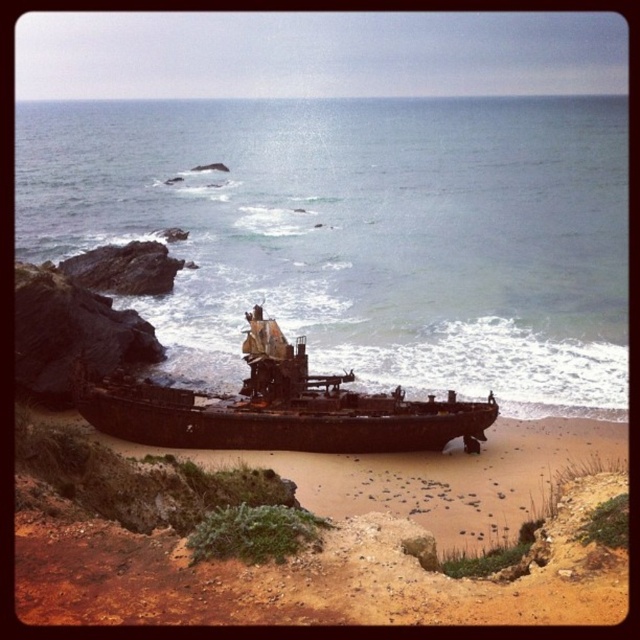
Consider the image. You are a marine biologist studying shipwrecks. You notice the clear blue water at lower center and the rusty metal pirate ship at center. Which object is above the other?

The clear blue water at lower center is positioned over the rusty metal pirate ship at center, so the water is above the ship.

You are standing on the beach and want to take a photo of the clear blue water at lower center and the rusty metal pirate ship at center. Which object should you focus on first if you want both to be in sharp focus?

You should focus on the rusty metal pirate ship at center first because it is closer to you than the clear blue water at lower center, which is further away. By focusing on the closer object, the background object will still be in acceptable focus.

You are a sailor stranded on the beach and see the clear blue water at lower center and the rusty metal pirate ship at center. Which object is located to the left of the other?

The clear blue water at lower center is positioned on the left side of the rusty metal pirate ship at center.